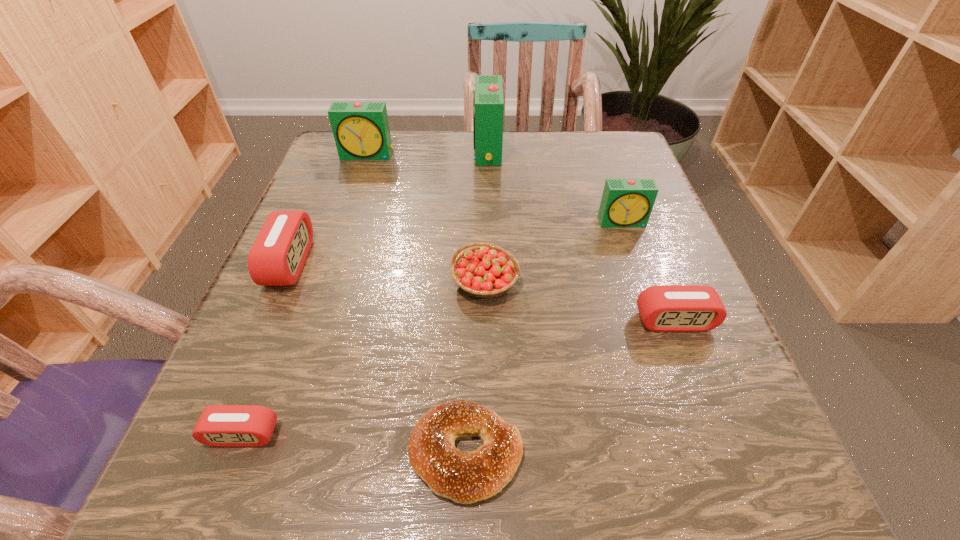
You are a GUI agent. You are given a task and a screenshot of the screen. Output one action in this format:
    pyautogui.click(x=<x>, y=<y>)
    Task: Click on the pink alarm clock that is the second closest to the smallest pink alarm clock
    
    Given the screenshot: What is the action you would take?
    pyautogui.click(x=666, y=308)

Where is `blank space that satisfies the following two spatial constraints: 1. on the front-facing side of the tallest object; 2. on the front-facing side of the fifth shortest alarm clock`? The height and width of the screenshot is (540, 960). blank space that satisfies the following two spatial constraints: 1. on the front-facing side of the tallest object; 2. on the front-facing side of the fifth shortest alarm clock is located at coordinates (488, 155).

Identify the location of vacant position in the image that satisfies the following two spatial constraints: 1. on the front-facing side of the farthest pink alarm clock; 2. on the back side of the strawberry. (281, 282).

Find the location of `vacant area that satisfies the following two spatial constraints: 1. on the front-facing side of the second tallest object; 2. on the front-facing side of the biggest pink alarm clock`. vacant area that satisfies the following two spatial constraints: 1. on the front-facing side of the second tallest object; 2. on the front-facing side of the biggest pink alarm clock is located at coordinates (331, 262).

The width and height of the screenshot is (960, 540). Identify the location of free spot that satisfies the following two spatial constraints: 1. on the front-facing side of the smallest pink alarm clock; 2. on the left side of the bagel. (235, 453).

Where is `vacant space that satisfies the following two spatial constraints: 1. on the front-facing side of the second smallest green alarm clock; 2. on the front-facing side of the biggest pink alarm clock`? This screenshot has height=540, width=960. vacant space that satisfies the following two spatial constraints: 1. on the front-facing side of the second smallest green alarm clock; 2. on the front-facing side of the biggest pink alarm clock is located at coordinates (331, 262).

What are the coordinates of `free space that satisfies the following two spatial constraints: 1. on the front-facing side of the bagel; 2. on the left side of the second biggest green alarm clock` in the screenshot? It's located at (268, 453).

The image size is (960, 540). What are the coordinates of `vacant space that satisfies the following two spatial constraints: 1. on the front-facing side of the second tallest object; 2. on the right side of the strawberry` in the screenshot? It's located at (324, 282).